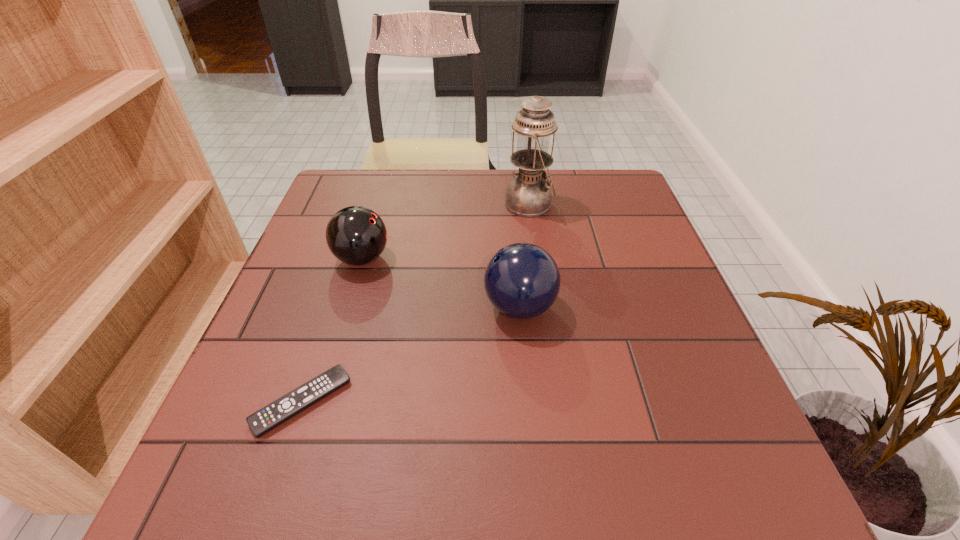
Image resolution: width=960 pixels, height=540 pixels. I want to click on the farthest object, so click(x=528, y=195).

You are a GUI agent. You are given a task and a screenshot of the screen. Output one action in this format:
    pyautogui.click(x=<x>, y=<y>)
    Task: Click on the oil lamp
    This screenshot has width=960, height=540.
    Given the screenshot: What is the action you would take?
    pyautogui.click(x=528, y=195)

Image resolution: width=960 pixels, height=540 pixels. Find the location of `the right bowling ball`. the right bowling ball is located at coordinates (522, 280).

Where is `the third farthest object`? This screenshot has height=540, width=960. the third farthest object is located at coordinates (522, 280).

This screenshot has width=960, height=540. In order to click on the farther bowling ball in this screenshot , I will do `click(356, 235)`.

At what (x,y) coordinates should I click in order to perform the action: click on the third nearest object. Please return your answer as a coordinate pair (x, y). Image resolution: width=960 pixels, height=540 pixels. Looking at the image, I should click on (356, 235).

The height and width of the screenshot is (540, 960). Identify the location of remote control. (274, 414).

Find the location of a particular element. the nearest object is located at coordinates (274, 414).

The width and height of the screenshot is (960, 540). Identify the location of vacant area situated on the left of the tallest object. (471, 204).

Where is `vacant space located 0.250m on the surface of the nearer bowling ball near the finger holes`? The height and width of the screenshot is (540, 960). vacant space located 0.250m on the surface of the nearer bowling ball near the finger holes is located at coordinates (363, 307).